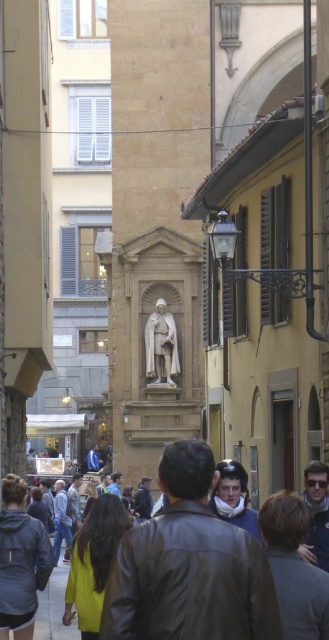
You are standing at the point marked as point [327,614] on a map of the city. A tour guide tells you that the distance between this point and the statue in the niche is 136.48 feet. If you want to walk directly to the statue, in which general direction should you head?

You should head towards the statue in the niche, as the distance between point [327,614] and the statue in the niche is 136.48 feet.

You are standing in the historic European city street scene. There are two points marked in the image. The first point is at coordinates point [198,552] and the second is at point [161,355]. Which point is closer to you?

Point [198,552] is closer to the viewer than point [161,355].

You are a photographer trying to capture both the dark gray leather jacket at lower right and the matte black jacket at lower right in the same frame. Which jacket will appear narrower in your photo?

The dark gray leather jacket at lower right will appear narrower in the photo because it has a lesser width compared to the matte black jacket at lower right.